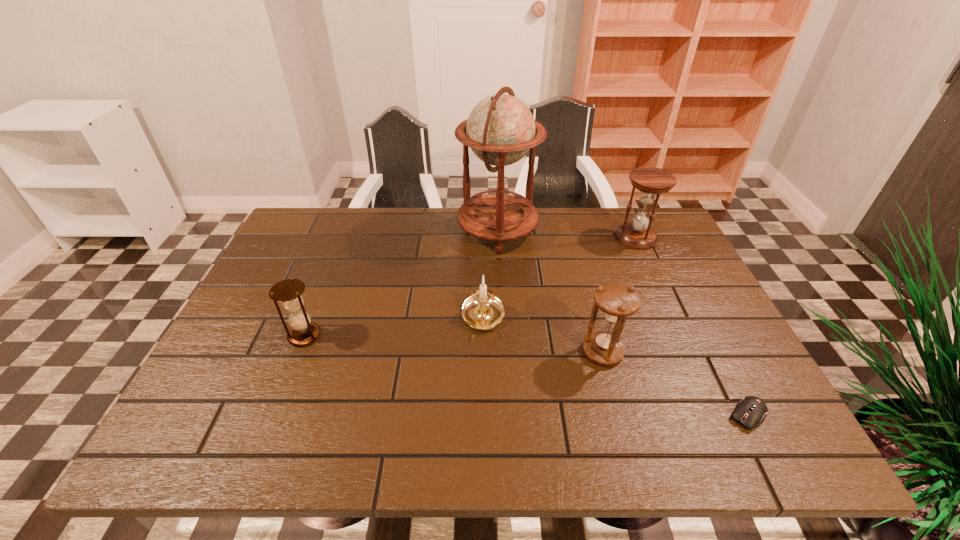
Find the location of a particular element. This screenshot has width=960, height=540. free space between the farthest hourglass and the second shortest object is located at coordinates pos(560,278).

You are a GUI agent. You are given a task and a screenshot of the screen. Output one action in this format:
    pyautogui.click(x=<x>, y=<y>)
    Task: Click on the free area in between the candle holder and the tallest object
    
    Given the screenshot: What is the action you would take?
    pyautogui.click(x=491, y=274)

Find the location of a particular element. Image resolution: width=960 pixels, height=540 pixels. vacant space that is in between the second hourglass from left to right and the fifth tallest object is located at coordinates (543, 334).

In order to click on vacant area between the fourth object from left to right and the leftmost object in this screenshot , I will do `click(454, 343)`.

Image resolution: width=960 pixels, height=540 pixels. What are the coordinates of `vacant space that's between the tallest object and the second hourglass from right to left` in the screenshot? It's located at (550, 291).

Where is `blank region between the candle holder and the second hourglass from right to left`? The height and width of the screenshot is (540, 960). blank region between the candle holder and the second hourglass from right to left is located at coordinates (543, 334).

What are the coordinates of `vacant area between the second shortest object and the computer mouse` in the screenshot? It's located at (615, 366).

Identify the location of free space between the computer mouse and the fourth object from left to right. The image size is (960, 540). (675, 383).

Locate which object ranks in proximity to the tallest object. Please provide its 2D coordinates. Your answer should be formatted as a tuple, i.e. [(x, y)], where the tuple contains the x and y coordinates of a point satisfying the conditions above.

[(482, 310)]

Locate which object is the third closest to the second hourglass from left to right. Please provide its 2D coordinates. Your answer should be formatted as a tuple, i.e. [(x, y)], where the tuple contains the x and y coordinates of a point satisfying the conditions above.

[(500, 130)]